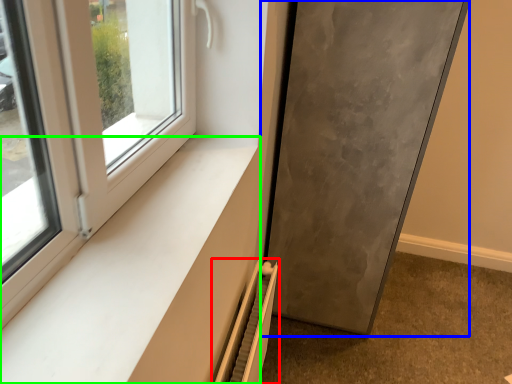
Question: Estimate the real-world distances between objects in this image. Which object is closer to radiator (highlighted by a red box), door (highlighted by a blue box) or window sill (highlighted by a green box)?

Choices:
 (A) door
 (B) window sill

Answer: (B)